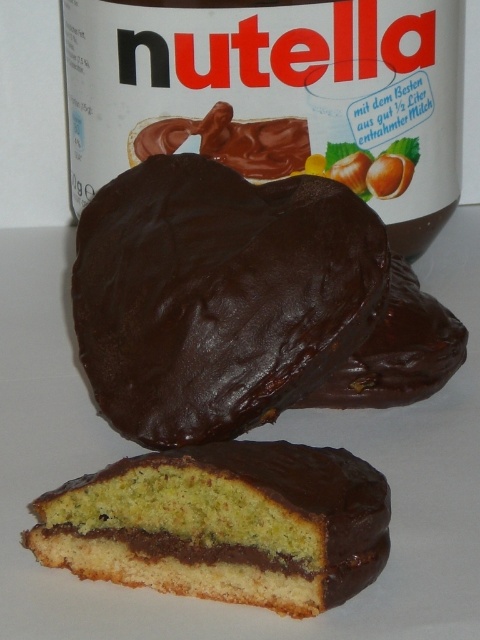
You are a food critic who needs to describe the center of the biscuit. What is located at the point with coordinates (x=218, y=296)?

The point at coordinates (x=218, y=296) indicates a shiny dark chocolate cake at center.

You are a food photographer and need to position a light source to highlight the shiny dark chocolate cake at center. Based on its position, where should you place the light source relative to the cake to create a reflection?

The shiny dark chocolate cake at center is located at point (218,296). To create a reflection, the light source should be placed opposite the camera, facing the cake so that the light reflects back into the camera lens.